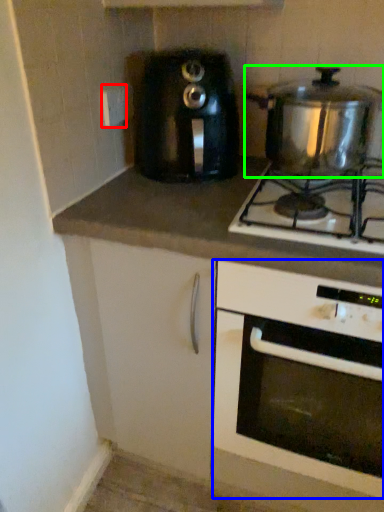
Question: Which is nearer to the electric outlet (highlighted by a red box)? oven (highlighted by a blue box) or kitchen appliance (highlighted by a green box).

Choices:
 (A) oven
 (B) kitchen appliance

Answer: (B)